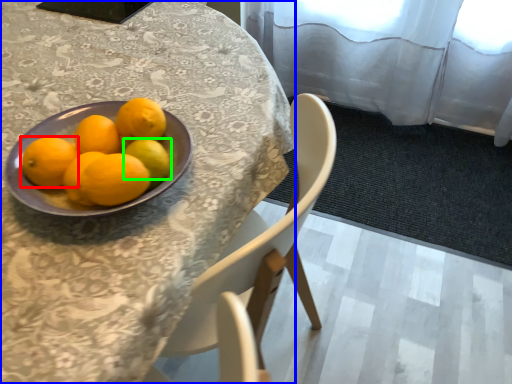
Question: Which object is positioned farthest from orange (highlighted by a red box)? Select from table (highlighted by a blue box) and lemon (highlighted by a green box).

Choices:
 (A) table
 (B) lemon

Answer: (A)